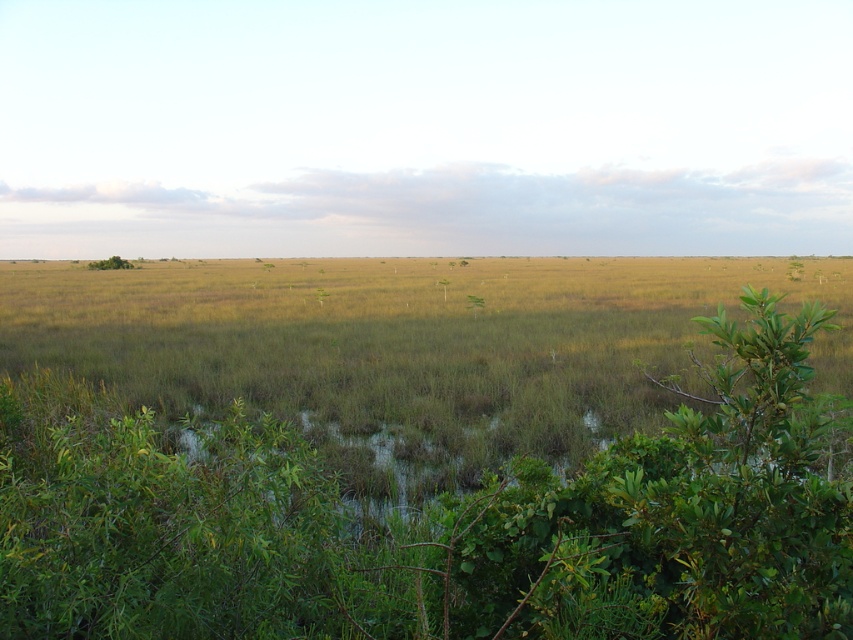
Measure the distance between point (108,259) and camera.

299.22 feet

Between green leafy tree at upper left and green leafy tree at center, which one is positioned lower?

green leafy tree at center is below.

This screenshot has width=853, height=640. Describe the element at coordinates (109, 262) in the screenshot. I see `green leafy tree at upper left` at that location.

Where is `green leafy tree at upper left`? This screenshot has width=853, height=640. green leafy tree at upper left is located at coordinates (109, 262).

Between green leafy tree at center-right and green leafy tree at center, which one has more height?

Standing taller between the two is green leafy tree at center-right.

Is green leafy tree at center-right taller than green leafy tree at center?

Yes, green leafy tree at center-right is taller than green leafy tree at center.

Who is more distant from viewer, (798, 262) or (439, 280)?

Positioned behind is point (798, 262).

Find the location of a particular element. The height and width of the screenshot is (640, 853). green leafy tree at center-right is located at coordinates [x=793, y=269].

Is green grassy tree at center further to the viewer compared to green leafy tree at center?

No, green grassy tree at center is in front of green leafy tree at center.

Can you confirm if green grassy tree at center is thinner than green leafy tree at center?

In fact, green grassy tree at center might be wider than green leafy tree at center.

Does point (323, 300) come behind point (439, 284)?

No, (323, 300) is in front of (439, 284).

Locate an element on the screen. The height and width of the screenshot is (640, 853). green grassy tree at center is located at coordinates (320, 296).